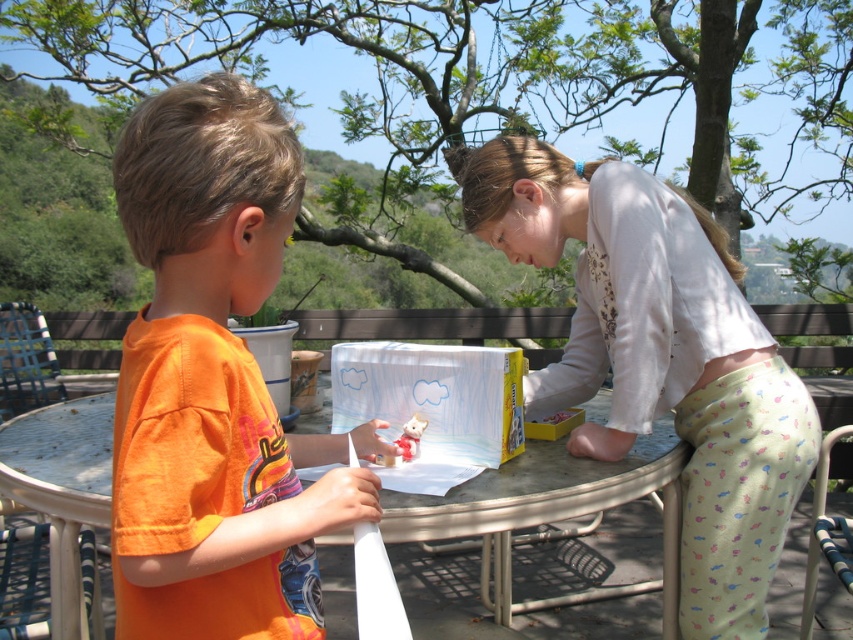
Question: Among these objects, which one is nearest to the camera?

Choices:
 (A) metallic silver table at center
 (B) orange cotton shirt at center
 (C) light beige cotton shirt at center

Answer: (B)

Question: Among these points, which one is nearest to the camera?

Choices:
 (A) 318,417
 (B) 218,186
 (C) 741,486

Answer: (B)

Question: Is orange cotton shirt at center positioned at the back of light beige cotton shirt at center?

Choices:
 (A) yes
 (B) no

Answer: (B)

Question: Can you confirm if orange cotton shirt at center is smaller than light beige cotton shirt at center?

Choices:
 (A) yes
 (B) no

Answer: (A)

Question: Is orange cotton shirt at center below metallic silver table at center?

Choices:
 (A) yes
 (B) no

Answer: (B)

Question: Among these points, which one is nearest to the camera?

Choices:
 (A) (64, 547)
 (B) (592, 433)
 (C) (236, 168)

Answer: (C)